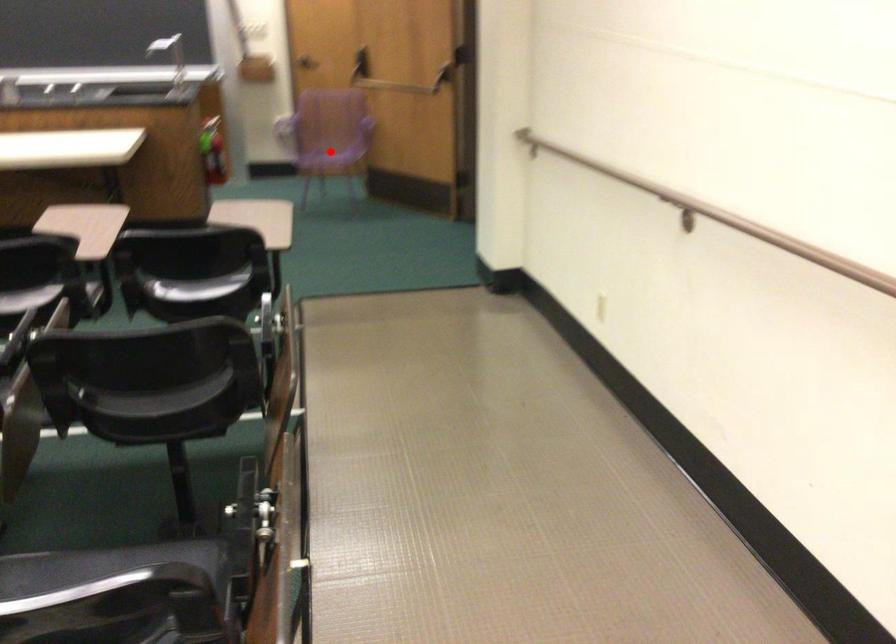
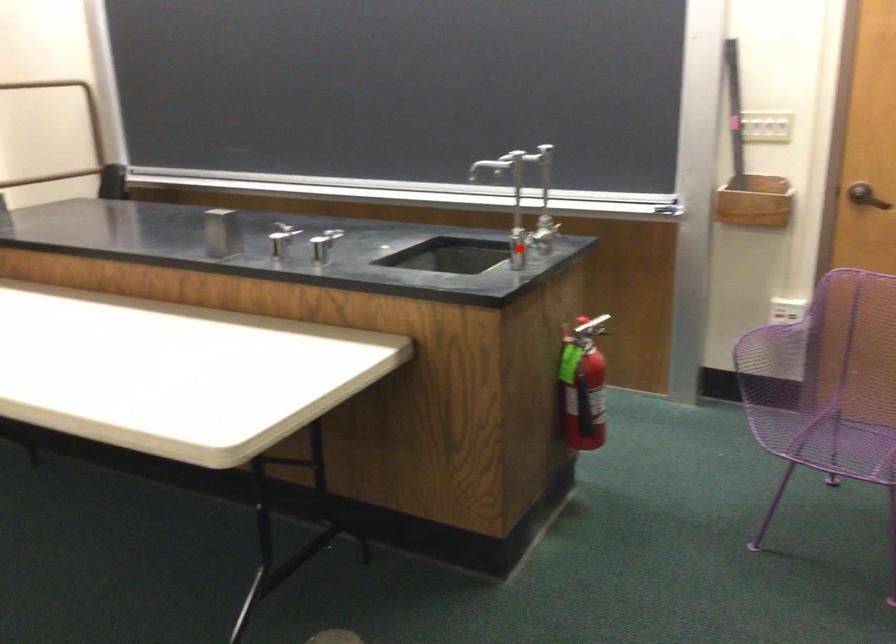
I am providing you with two images of the same scene from different viewpoints. A red point is marked on the first image and another point is marked on the second image. Does the point marked in image1 correspond to the same location as the one in image2?

No